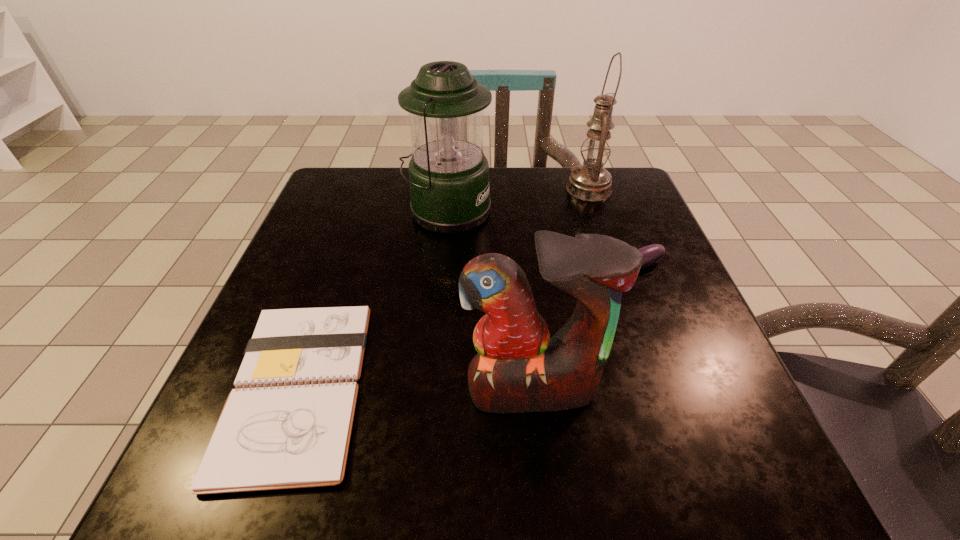
Locate an element on the screen. lantern is located at coordinates (448, 173).

Locate an element on the screen. oil lamp is located at coordinates (591, 181).

I want to click on the third tallest object, so click(519, 368).

At what (x,y) coordinates should I click in order to perform the action: click on the fourth tallest object. Please return your answer as a coordinate pair (x, y). The image size is (960, 540). Looking at the image, I should click on (652, 253).

You are a GUI agent. You are given a task and a screenshot of the screen. Output one action in this format:
    pyautogui.click(x=<x>, y=<y>)
    Task: Click on the eggplant
    
    Given the screenshot: What is the action you would take?
    pyautogui.click(x=652, y=253)

Where is `notepad`? notepad is located at coordinates (288, 423).

Identify the location of vacant area situated 0.270m on the right of the lantern. This screenshot has height=540, width=960. (606, 211).

Find the location of a particular element. The width and height of the screenshot is (960, 540). free location located 0.050m on the back of the oil lamp is located at coordinates pos(582,167).

Find the location of a particular element. vacant space located 0.050m at the face of the parrot is located at coordinates (539, 450).

You are a GUI agent. You are given a task and a screenshot of the screen. Output one action in this format:
    pyautogui.click(x=<x>, y=<y>)
    Task: Click on the blank space located 0.100m on the back of the eggplant
    
    Given the screenshot: What is the action you would take?
    pyautogui.click(x=610, y=227)